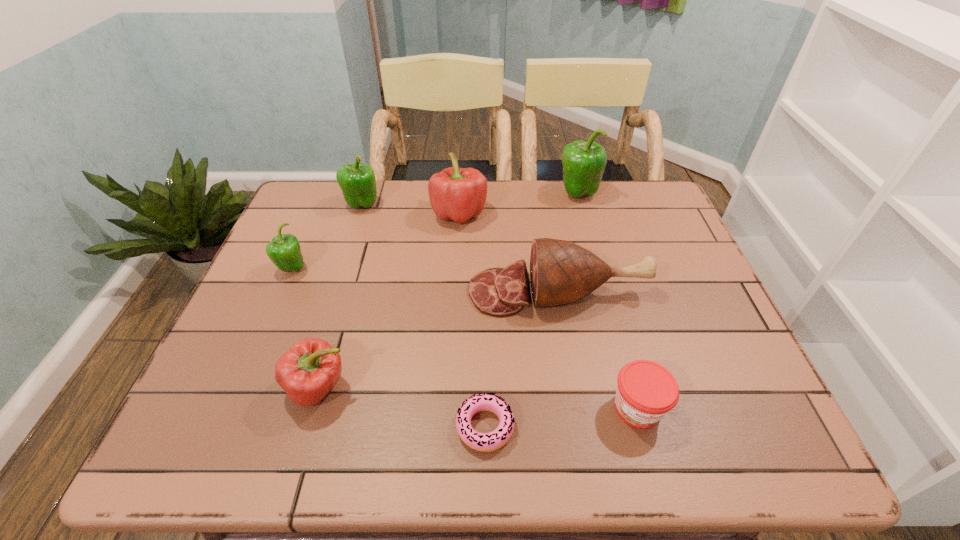
Find the location of `the second shortest object`. the second shortest object is located at coordinates (646, 391).

Locate an element on the screen. The image size is (960, 540). jam is located at coordinates (646, 391).

Where is `the shortest object`? the shortest object is located at coordinates (485, 442).

Locate an element on the screen. The width and height of the screenshot is (960, 540). pink doughnut is located at coordinates (485, 442).

Where is `blank space located 0.250m on the left of the rightmost bell pepper`? The height and width of the screenshot is (540, 960). blank space located 0.250m on the left of the rightmost bell pepper is located at coordinates (478, 193).

At what (x,y) coordinates should I click in order to perform the action: click on vacant region located 0.400m on the right of the second smallest green bell pepper. Please return your answer as a coordinate pair (x, y). This screenshot has width=960, height=540. Looking at the image, I should click on click(509, 204).

The width and height of the screenshot is (960, 540). Find the location of `vacant region located 0.280m on the front of the fourth bell pepper from left to right`. vacant region located 0.280m on the front of the fourth bell pepper from left to right is located at coordinates (454, 305).

Locate an element on the screen. Image resolution: width=960 pixels, height=540 pixels. vacant space located 0.060m at the sliced end of the ham is located at coordinates (x=444, y=292).

You are a GUI agent. You are given a task and a screenshot of the screen. Output one action in this format:
    pyautogui.click(x=<x>, y=<y>)
    Task: Click on the vacant point located 0.280m at the sliced end of the ham
    This screenshot has height=540, width=960.
    Given the screenshot: What is the action you would take?
    pyautogui.click(x=356, y=292)

In order to click on free point located 0.350m at the sliced end of the ham in this screenshot , I will do `click(328, 292)`.